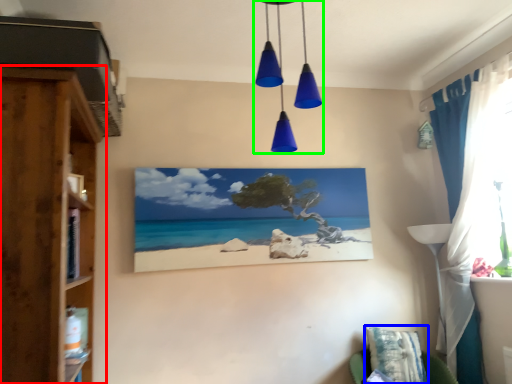
Question: Based on their relative distances, which object is nearer to cupboard (highlighted by a red box)? Choose from pillow (highlighted by a blue box) and light fixture (highlighted by a green box).

Choices:
 (A) pillow
 (B) light fixture

Answer: (B)